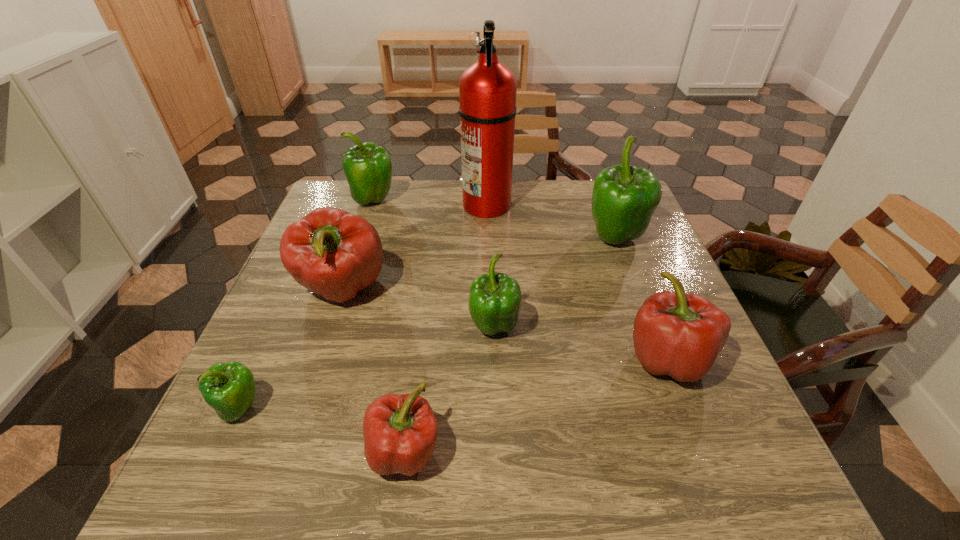
Where is `red fire extinguisher`? The height and width of the screenshot is (540, 960). red fire extinguisher is located at coordinates (487, 89).

Locate an element on the screen. The image size is (960, 540). fire extinguisher is located at coordinates (487, 89).

Identify the location of the second farthest bell pepper. Image resolution: width=960 pixels, height=540 pixels. (624, 197).

Identify the location of the tallest bell pepper. This screenshot has height=540, width=960. (624, 197).

Where is `the third smallest green bell pepper`? This screenshot has width=960, height=540. the third smallest green bell pepper is located at coordinates [x=368, y=169].

This screenshot has height=540, width=960. I want to click on the farthest bell pepper, so click(368, 169).

Identify the location of the biggest pink bell pepper. The height and width of the screenshot is (540, 960). (333, 253).

I want to click on the leftmost pink bell pepper, so click(x=333, y=253).

This screenshot has width=960, height=540. What are the coordinates of `the second green bell pepper from right to left` in the screenshot? It's located at (495, 299).

What are the coordinates of `the third bell pepper from right to left` in the screenshot? It's located at (495, 299).